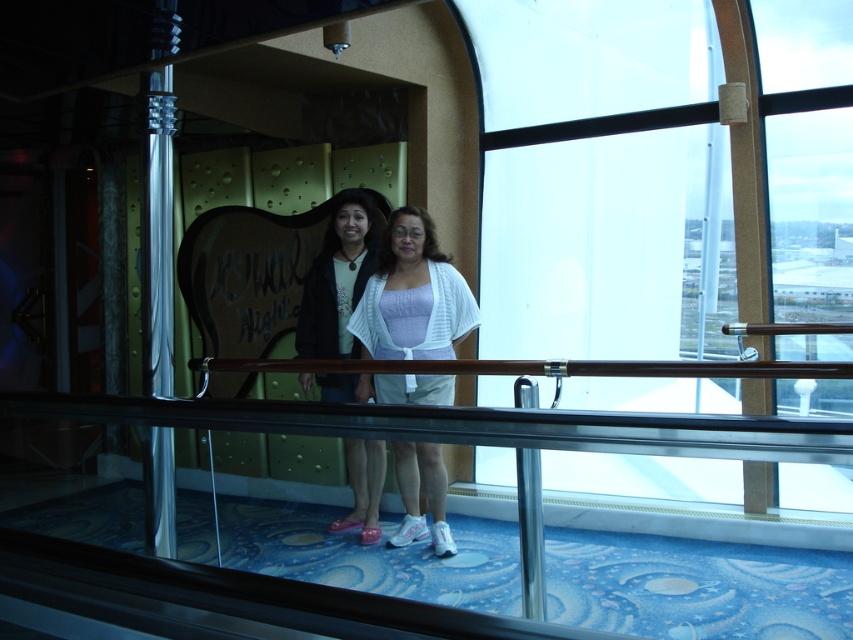
You are a photographer taking a picture of the two people wearing the white knit cardigan at center and the matte black jacket at center. Which one should you focus on first if you want to capture them from left to right order?

The matte black jacket at center should be focused on first since it is positioned to the left of the white knit cardigan at center, which is to its right.

You are a photographer trying to capture both the white knit cardigan at center and the matte black jacket at center in a single frame. Since you want to ensure both are fully visible, which clothing item requires more horizontal space in the frame?

The white knit cardigan at center requires more horizontal space in the frame because its width is larger than that of the matte black jacket at center.